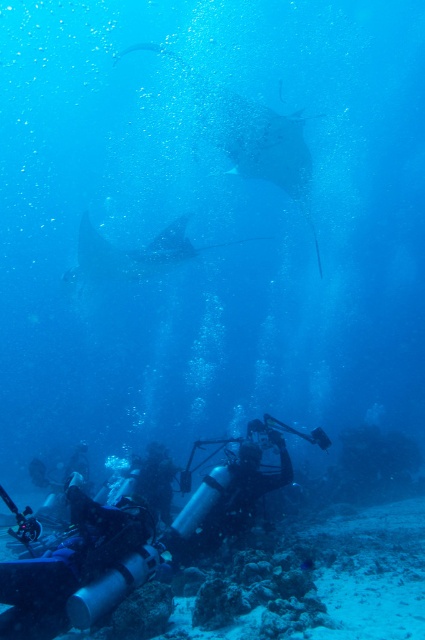
You are a marine biologist observing the underwater scene. You notice the black rubber diving suit at lower center and the smooth gray stingray at center. Which object is taller in this scene?

The black rubber diving suit at lower center is taller than the smooth gray stingray at center.

You are a marine biologist studying underwater interactions. You notice the black rubber diving suit at lower center and the smooth gray stingray at center. Which object is positioned to the right of the other?

The black rubber diving suit at lower center is to the right of the smooth gray stingray at center.

You are a marine biologist observing the underwater scene. You notice the black rubber diving suit at lower center and the smooth gray stingray at center. Which object is closer to the surface of the water?

The smooth gray stingray at center is closer to the surface of the water because the black rubber diving suit at lower center is positioned under it.